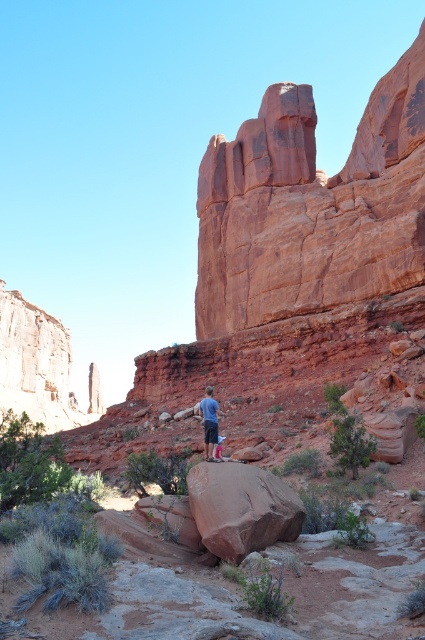
Can you confirm if rustic sandstone rock formation at upper center is wider than matte blue shirt at center?

Indeed, rustic sandstone rock formation at upper center has a greater width compared to matte blue shirt at center.

The height and width of the screenshot is (640, 425). I want to click on rustic sandstone rock formation at upper center, so click(311, 208).

Locate an element on the screen. rustic sandstone rock formation at upper center is located at coordinates (311, 208).

Measure the distance between rustic sandstone boulder at center and matte blue shirt at center.

The distance of rustic sandstone boulder at center from matte blue shirt at center is 28.15 feet.

Who is lower down, rustic sandstone boulder at center or matte blue shirt at center?

Positioned lower is rustic sandstone boulder at center.

Which is in front, point (254, 500) or point (203, 401)?

Point (254, 500) is in front.

Image resolution: width=425 pixels, height=640 pixels. In order to click on rustic sandstone boulder at center in this screenshot , I will do [241, 508].

Does rustic sandstone rock formation at upper center come in front of rustic sandstone boulder at center?

No.

Between point (337, 220) and point (203, 541), which one is positioned behind?

Positioned behind is point (337, 220).

Identify the location of rustic sandstone rock formation at upper center. (311, 208).